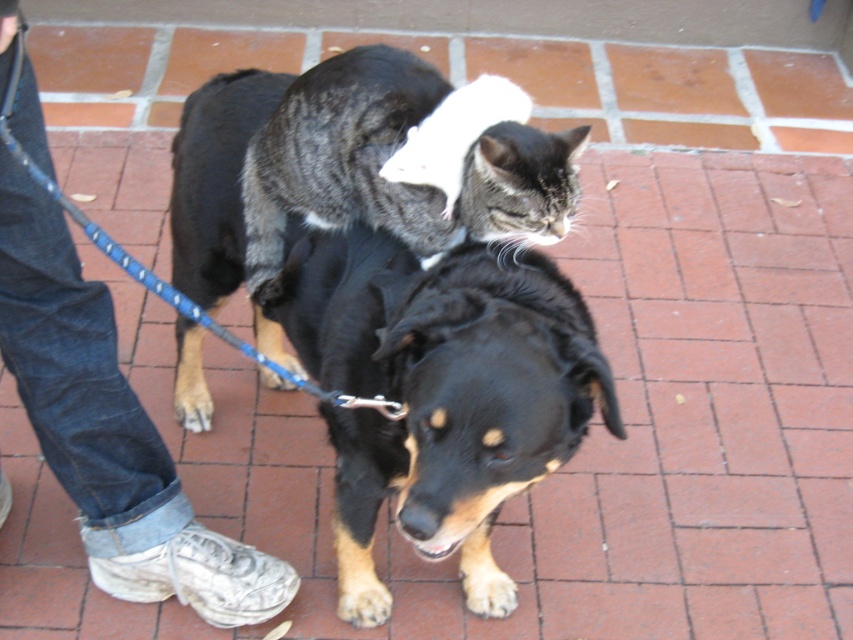
Can you confirm if black fur dog at center is positioned to the left of tabby fur cat at center?

Correct, you'll find black fur dog at center to the left of tabby fur cat at center.

Is point (392, 481) positioned behind point (467, 200)?

Yes, it is.

Is point (384, 362) positioned in front of point (361, 124)?

Yes, point (384, 362) is closer to viewer.

Where is `black fur dog at center`? black fur dog at center is located at coordinates (439, 394).

Does point (173, 262) come behind point (54, 339)?

Yes, point (173, 262) is farther from viewer.

Where is `black fur dog at center`? The width and height of the screenshot is (853, 640). black fur dog at center is located at coordinates (439, 394).

This screenshot has width=853, height=640. I want to click on black fur dog at center, so click(x=439, y=394).

Who is more forward, (68,444) or (357,148)?

Positioned in front is point (357,148).

Can you confirm if jeans at lower left is positioned above tabby fur cat at center?

No.

Is point (119, 496) more distant than point (392, 60)?

Yes.

The width and height of the screenshot is (853, 640). Identify the location of jeans at lower left. (109, 429).